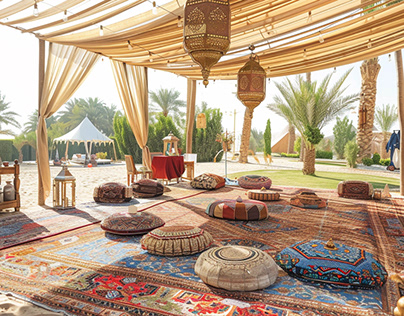
Identify the location of table cloth. (170, 158).